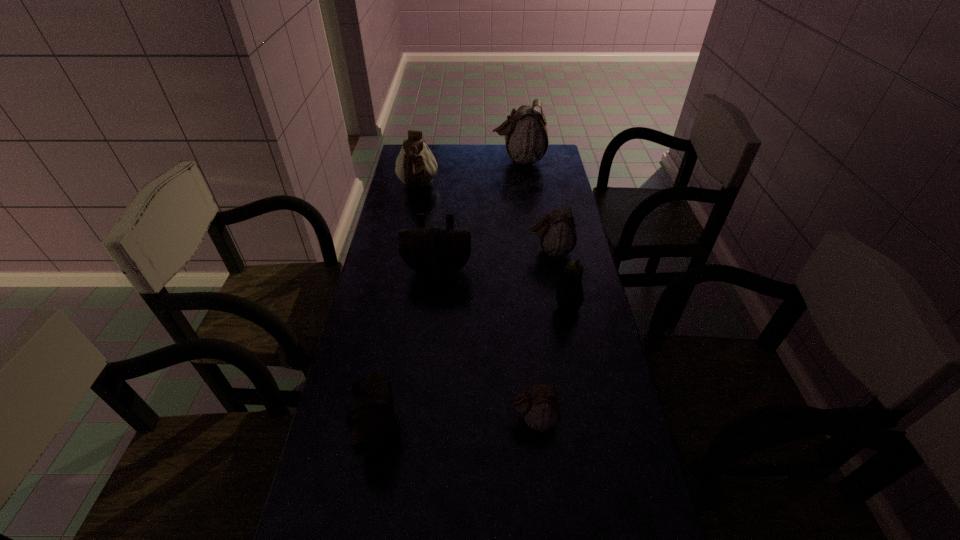
The width and height of the screenshot is (960, 540). What are the coordinates of `vacant space in between the eggplant and the second farthest white pouch` in the screenshot? It's located at (492, 247).

Identify the location of vacant space that's between the third nearest white pouch and the eggplant. The height and width of the screenshot is (540, 960). (492, 247).

I want to click on free space between the leftmost white pouch and the nearest white pouch, so click(x=475, y=303).

The height and width of the screenshot is (540, 960). In order to click on empty space between the third biggest white pouch and the smaller brown pouch in this screenshot , I will do `click(465, 342)`.

Find the location of `empty space between the bigger brown pouch and the farthest pouch`. empty space between the bigger brown pouch and the farthest pouch is located at coordinates (478, 215).

Choose which object is the sixth nearest neighbor to the eggplant. Please provide its 2D coordinates. Your answer should be formatted as a tuple, i.e. [(x, y)], where the tuple contains the x and y coordinates of a point satisfying the conditions above.

[(526, 137)]

Identify which object is located as the nearest to the biggest white pouch. Please provide its 2D coordinates. Your answer should be formatted as a tuple, i.e. [(x, y)], where the tuple contains the x and y coordinates of a point satisfying the conditions above.

[(415, 165)]

Locate an element on the screen. This screenshot has width=960, height=540. the fifth closest pouch to the third nearest object is located at coordinates coord(415,165).

I want to click on pouch identified as the sixth closest to the eggplant, so click(526, 137).

Select which white pouch is the third closest to the farther brown pouch. Please provide its 2D coordinates. Your answer should be formatted as a tuple, i.e. [(x, y)], where the tuple contains the x and y coordinates of a point satisfying the conditions above.

[(540, 407)]